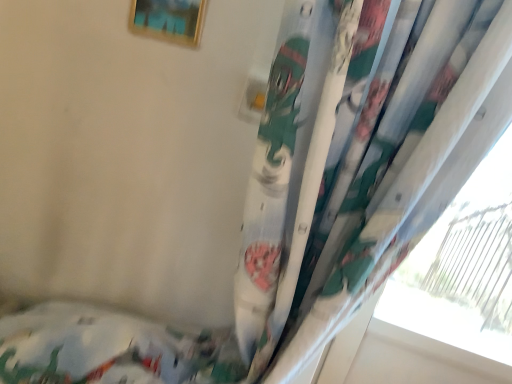
I want to click on white cotton bed at lower left, so click(x=109, y=349).

Consider the image. In order to face white cotton bed at lower left, should I rotate leftwards or rightwards?

To align with it, rotate left about 25.465°.

What do you see at coordinates (109, 349) in the screenshot? The image size is (512, 384). I see `white cotton bed at lower left` at bounding box center [109, 349].

Describe the element at coordinates (168, 20) in the screenshot. The height and width of the screenshot is (384, 512). I see `gold metallic picture frame at upper center` at that location.

This screenshot has width=512, height=384. I want to click on gold metallic picture frame at upper center, so click(x=168, y=20).

Where is `white cotton bed at lower left`? white cotton bed at lower left is located at coordinates 109,349.

Considering the relative positions of gold metallic picture frame at upper center and white cotton bed at lower left in the image provided, is gold metallic picture frame at upper center to the right of white cotton bed at lower left from the viewer's perspective?

Yes.

Which object is closer to the camera, gold metallic picture frame at upper center or white cotton bed at lower left?

gold metallic picture frame at upper center.

Is point (163, 32) closer or farther from the camera than point (90, 353)?

Point (163, 32) is closer to the camera than point (90, 353).

From the image's perspective, relative to white cotton bed at lower left, is gold metallic picture frame at upper center above or below?

Based on their image positions, gold metallic picture frame at upper center is located above white cotton bed at lower left.

From a real-world perspective, between gold metallic picture frame at upper center and white cotton bed at lower left, who is vertically lower?

white cotton bed at lower left is physically lower.

Between gold metallic picture frame at upper center and white cotton bed at lower left, which one has larger width?

With larger width is white cotton bed at lower left.

Can you confirm if gold metallic picture frame at upper center is taller than white cotton bed at lower left?

No.

Considering the sizes of gold metallic picture frame at upper center and white cotton bed at lower left in the image, is gold metallic picture frame at upper center bigger or smaller than white cotton bed at lower left?

In the image, gold metallic picture frame at upper center appears to be smaller than white cotton bed at lower left.

Which is correct: gold metallic picture frame at upper center is inside white cotton bed at lower left, or outside of it?

gold metallic picture frame at upper center lies outside white cotton bed at lower left.

In the scene shown: Does gold metallic picture frame at upper center touch white cotton bed at lower left?

No, gold metallic picture frame at upper center is not with white cotton bed at lower left.

Is gold metallic picture frame at upper center turned away from white cotton bed at lower left?

No, gold metallic picture frame at upper center is not facing the opposite direction of white cotton bed at lower left.

How distant is gold metallic picture frame at upper center from white cotton bed at lower left?

The distance of gold metallic picture frame at upper center from white cotton bed at lower left is 25.64 inches.

In the image, there is a gold metallic picture frame at upper center. In order to click on bed below it (from a real-world perspective) in this screenshot , I will do `click(109, 349)`.

Visually, is white cotton bed at lower left positioned to the left or to the right of gold metallic picture frame at upper center?

Clearly, white cotton bed at lower left is on the left of gold metallic picture frame at upper center in the image.

Considering the positions of objects white cotton bed at lower left and gold metallic picture frame at upper center in the image provided, who is in front, white cotton bed at lower left or gold metallic picture frame at upper center?

gold metallic picture frame at upper center is more forward.

Between point (168, 329) and point (182, 17), which one is positioned behind?

Positioned behind is point (168, 329).

From the image's perspective, which is below, white cotton bed at lower left or gold metallic picture frame at upper center?

From the image's view, white cotton bed at lower left is below.

From a real-world perspective, is white cotton bed at lower left on top of gold metallic picture frame at upper center?

No, from a real-world perspective, white cotton bed at lower left is not over gold metallic picture frame at upper center

Does white cotton bed at lower left have a greater width compared to gold metallic picture frame at upper center?

Indeed, white cotton bed at lower left has a greater width compared to gold metallic picture frame at upper center.

Which of these two, white cotton bed at lower left or gold metallic picture frame at upper center, stands shorter?

gold metallic picture frame at upper center is shorter.

Which of these two, white cotton bed at lower left or gold metallic picture frame at upper center, is smaller?

Smaller between the two is gold metallic picture frame at upper center.

Is gold metallic picture frame at upper center completely or partially inside white cotton bed at lower left?

No, white cotton bed at lower left does not contain gold metallic picture frame at upper center.

Consider the image. Is white cotton bed at lower left not near gold metallic picture frame at upper center?

white cotton bed at lower left is actually quite close to gold metallic picture frame at upper center.

Is white cotton bed at lower left facing towards gold metallic picture frame at upper center?

No, white cotton bed at lower left does not turn towards gold metallic picture frame at upper center.

This screenshot has width=512, height=384. Find the location of `bed behind the gold metallic picture frame at upper center`. bed behind the gold metallic picture frame at upper center is located at coordinates (109, 349).

Find the location of `bed below the gold metallic picture frame at upper center (from the image's perspective)`. bed below the gold metallic picture frame at upper center (from the image's perspective) is located at coordinates (109, 349).

This screenshot has width=512, height=384. Identify the location of bed below the gold metallic picture frame at upper center (from a real-world perspective). (109, 349).